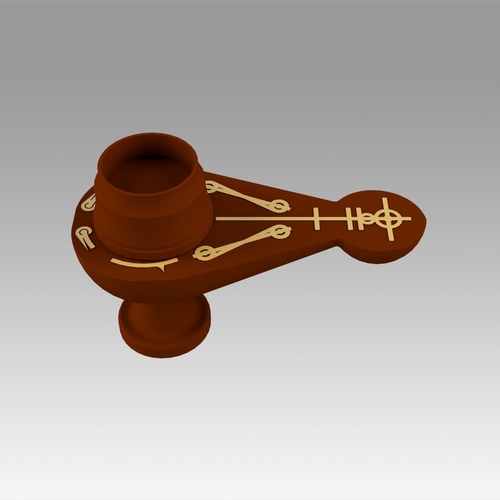
What are the coordinates of `voyager vulcan styled meditation lamp` in the screenshot? It's located at (179, 280).